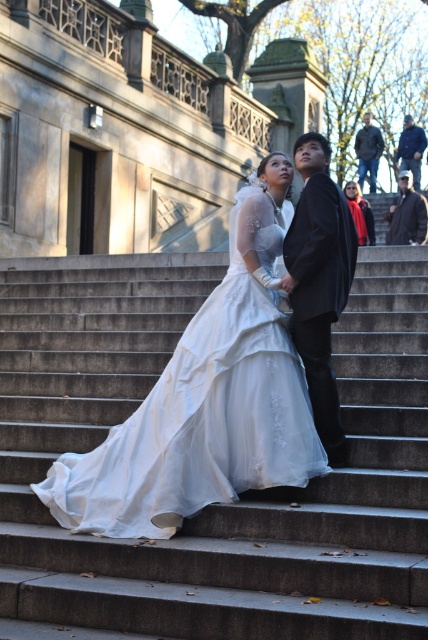
Question: Which is nearer to the blue denim jacket at upper right?

Choices:
 (A) shiny black suit at center
 (B) white satin dress at center
 (C) dark gray wool coat at upper right
 (D) denim jacket at upper right

Answer: (D)

Question: Does white satin dress at center have a smaller size compared to dark gray wool coat at upper right?

Choices:
 (A) yes
 (B) no

Answer: (A)

Question: Can you confirm if white satin dress at center is thinner than dark gray wool coat at upper right?

Choices:
 (A) yes
 (B) no

Answer: (A)

Question: Which point is farther to the camera?

Choices:
 (A) (368, 157)
 (B) (336, 406)
 (C) (410, 225)
 (D) (404, 131)

Answer: (D)

Question: Which object is farther from the camera taking this photo?

Choices:
 (A) blue denim jacket at upper right
 (B) dark gray wool coat at upper right
 (C) smooth concrete stairs at center
 (D) white satin dress at center

Answer: (A)

Question: Is shiny black suit at center bigger than dark gray wool coat at upper right?

Choices:
 (A) no
 (B) yes

Answer: (A)